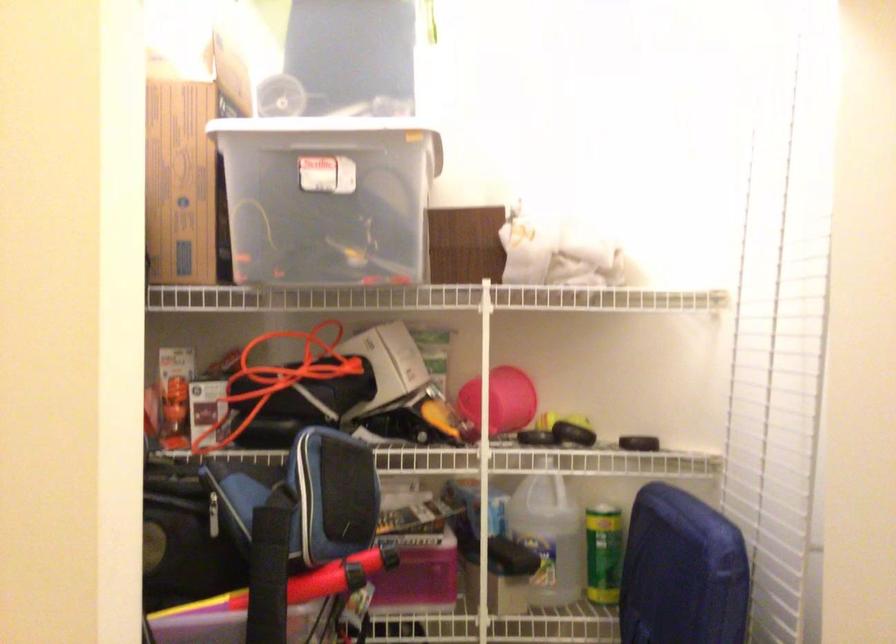
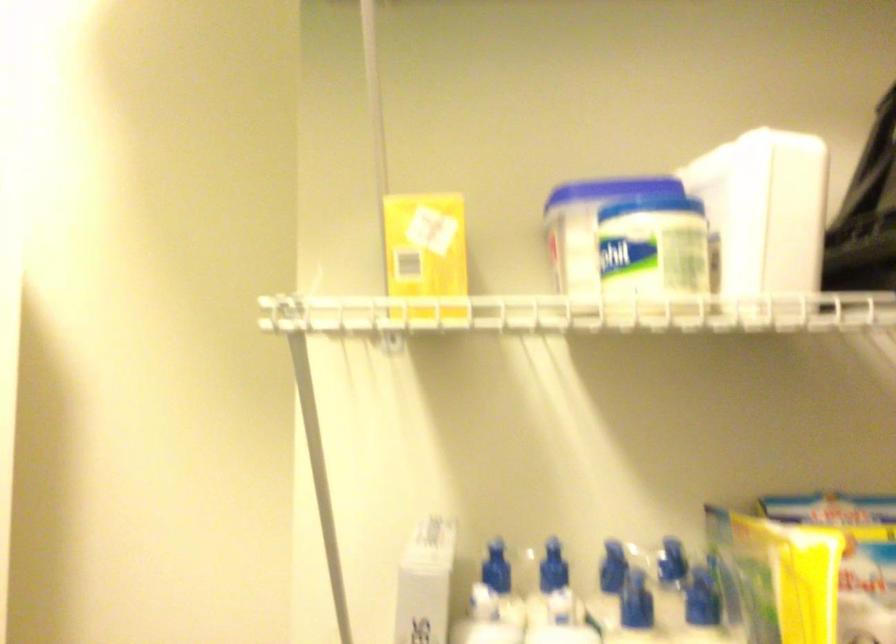
Question: How did the camera likely rotate?

Choices:
 (A) Left
 (B) Right
 (C) Up
 (D) Down

Answer: (B)